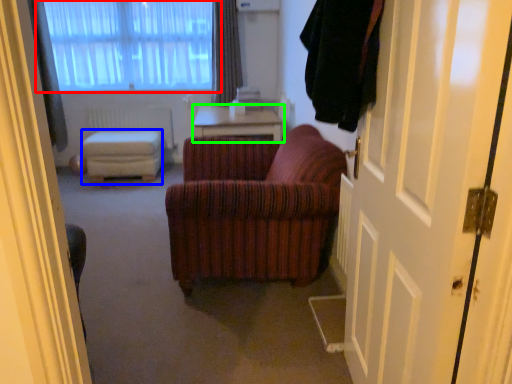
Question: Which object is positioned closest to window (highlighted by a red box)? Select from stool (highlighted by a blue box) and table (highlighted by a green box).

Choices:
 (A) stool
 (B) table

Answer: (A)